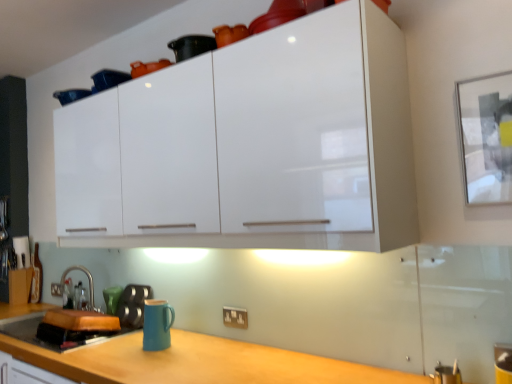
Identify the location of white plastic electric outlet at lower center. (234, 317).

Image resolution: width=512 pixels, height=384 pixels. What do you see at coordinates (112, 298) in the screenshot? I see `teal ceramic mug at lower left` at bounding box center [112, 298].

Measure the distance between teal ceramic mug at lower left and camera.

A distance of 2.49 meters exists between teal ceramic mug at lower left and camera.

Looking at this image, what is the approximate height of satin nickel faucet at lower left?

The height of satin nickel faucet at lower left is 12.44 inches.

This screenshot has height=384, width=512. What do you see at coordinates (157, 325) in the screenshot?
I see `matte blue mug at lower center` at bounding box center [157, 325].

The height and width of the screenshot is (384, 512). I want to click on white plastic electric outlet at lower center, so click(x=234, y=317).

From a real-world perspective, who is located higher, matte blue mug at lower center or matte black kettle at lower left?

In real-world perspective, matte blue mug at lower center is above.

Considering the relative positions of matte blue mug at lower center and matte black kettle at lower left in the image provided, is matte blue mug at lower center behind matte black kettle at lower left?

No, the depth of matte blue mug at lower center is less than that of matte black kettle at lower left.

Visually, is matte blue mug at lower center positioned to the left or to the right of matte black kettle at lower left?

In the image, matte blue mug at lower center appears on the right side of matte black kettle at lower left.

Are matte blue mug at lower center and satin nickel faucet at lower left located far from each other?

Yes, matte blue mug at lower center and satin nickel faucet at lower left are located far from each other.

Considering the points (157, 328) and (92, 286), which point is behind, point (157, 328) or point (92, 286)?

Point (92, 286)

Could satin nickel faucet at lower left be considered to be inside matte blue mug at lower center?

Definitely not — satin nickel faucet at lower left is not inside matte blue mug at lower center.

What's the angular difference between matte blue mug at lower center and satin nickel faucet at lower left's facing directions?

matte blue mug at lower center and satin nickel faucet at lower left are facing 0.000335 degrees away from each other.

Locate an element on the screen. This screenshot has width=512, height=384. appliance below the matte blue mug at lower center (from the image's perspective) is located at coordinates (133, 305).

Can you confirm if matte black kettle at lower left is taller than matte blue mug at lower center?

Yes.

Is matte black kettle at lower left not within matte blue mug at lower center?

Indeed, matte black kettle at lower left is completely outside matte blue mug at lower center.

From a real-world perspective, who is located lower, white plastic electric outlet at lower center or teal ceramic mug at lower left?

white plastic electric outlet at lower center, from a real-world perspective.

The height and width of the screenshot is (384, 512). What are the coordinates of `teal below the white plastic electric outlet at lower center (from the image's perspective)` in the screenshot? It's located at (112, 298).

Considering the sizes of objects white plastic electric outlet at lower center and teal ceramic mug at lower left in the image provided, who is wider, white plastic electric outlet at lower center or teal ceramic mug at lower left?

With larger width is teal ceramic mug at lower left.

Looking at the image, does white plastic electric outlet at lower center seem bigger or smaller compared to teal ceramic mug at lower left?

In the image, white plastic electric outlet at lower center appears to be smaller than teal ceramic mug at lower left.

Is matte black kettle at lower left facing away from teal ceramic mug at lower left?

No, matte black kettle at lower left's orientation is not away from teal ceramic mug at lower left.

From a real-world perspective, does matte black kettle at lower left stand above teal ceramic mug at lower left?

No, from a real-world perspective, matte black kettle at lower left is not on top of teal ceramic mug at lower left.

Is matte black kettle at lower left taller or shorter than teal ceramic mug at lower left?

Considering their sizes, matte black kettle at lower left has more height than teal ceramic mug at lower left.

Could you measure the distance between white glossy cabinet at upper center and white plastic electric outlet at lower center?

white glossy cabinet at upper center and white plastic electric outlet at lower center are 90.28 centimeters apart from each other.

Considering the sizes of objects white glossy cabinet at upper center and white plastic electric outlet at lower center in the image provided, who is bigger, white glossy cabinet at upper center or white plastic electric outlet at lower center?

With larger size is white glossy cabinet at upper center.

Which object is further away from the camera, white glossy cabinet at upper center or white plastic electric outlet at lower center?

white plastic electric outlet at lower center is further from the camera.

Can we say white glossy cabinet at upper center lies outside white plastic electric outlet at lower center?

That's correct, white glossy cabinet at upper center is outside of white plastic electric outlet at lower center.

Is point (370, 165) positioned in front of point (67, 271)?

Yes, it is.

Would you consider white glossy cabinet at upper center to be distant from satin nickel faucet at lower left?

That's right, there is a large distance between white glossy cabinet at upper center and satin nickel faucet at lower left.

This screenshot has width=512, height=384. What are the coordinates of `cabinetry in front of the satin nickel faucet at lower left` in the screenshot? It's located at (263, 146).

From a real-world perspective, relative to satin nickel faucet at lower left, is white glossy cabinet at upper center vertically above or below?

Clearly, from a real-world perspective, white glossy cabinet at upper center is above satin nickel faucet at lower left.

This screenshot has width=512, height=384. I want to click on mug above the matte black kettle at lower left (from the image's perspective), so click(x=157, y=325).

Find the location of `mug located in front of the satin nickel faucet at lower left`. mug located in front of the satin nickel faucet at lower left is located at coordinates (157, 325).

Looking at this image, estimate the real-world distances between objects in this image. Which object is closer to matte blue mug at lower center, white glossy cabinet at upper center or teal ceramic mug at lower left?

teal ceramic mug at lower left is positioned closer to the anchor matte blue mug at lower center.

Estimate the real-world distances between objects in this image. Which object is further from teal ceramic mug at lower left, white glossy cabinet at upper center or white plastic electric outlet at lower center?

white glossy cabinet at upper center lies further to teal ceramic mug at lower left than the other object.

Which object lies nearer to the anchor point white glossy cabinet at upper center, satin nickel faucet at lower left or white plastic electric outlet at lower center?

white plastic electric outlet at lower center.

From the image, which object appears to be farther from white plastic electric outlet at lower center, satin nickel faucet at lower left or matte black kettle at lower left?

satin nickel faucet at lower left lies further to white plastic electric outlet at lower center than the other object.

Looking at this image, based on their spatial positions, is matte black kettle at lower left or satin nickel faucet at lower left closer to white glossy cabinet at upper center?

matte black kettle at lower left.

Looking at the image, which one is located further to satin nickel faucet at lower left, matte black kettle at lower left or white plastic electric outlet at lower center?

white plastic electric outlet at lower center.

Estimate the real-world distances between objects in this image. Which object is closer to matte black kettle at lower left, teal ceramic mug at lower left or matte blue mug at lower center?

teal ceramic mug at lower left lies closer to matte black kettle at lower left than the other object.

Estimate the real-world distances between objects in this image. Which object is closer to white plastic electric outlet at lower center, matte blue mug at lower center or satin nickel faucet at lower left?

Based on the image, matte blue mug at lower center appears to be nearer to white plastic electric outlet at lower center.

Where is `appliance located between satin nickel faucet at lower left and white plastic electric outlet at lower center in the left-right direction`? appliance located between satin nickel faucet at lower left and white plastic electric outlet at lower center in the left-right direction is located at coordinates (133, 305).

Find the location of a particular element. electric outlet between white glossy cabinet at upper center and matte blue mug at lower center in the vertical direction is located at coordinates (234, 317).

The width and height of the screenshot is (512, 384). I want to click on appliance between teal ceramic mug at lower left and white plastic electric outlet at lower center, so click(133, 305).

Identify the location of appliance between matte blue mug at lower center and teal ceramic mug at lower left from front to back. Image resolution: width=512 pixels, height=384 pixels. (133, 305).